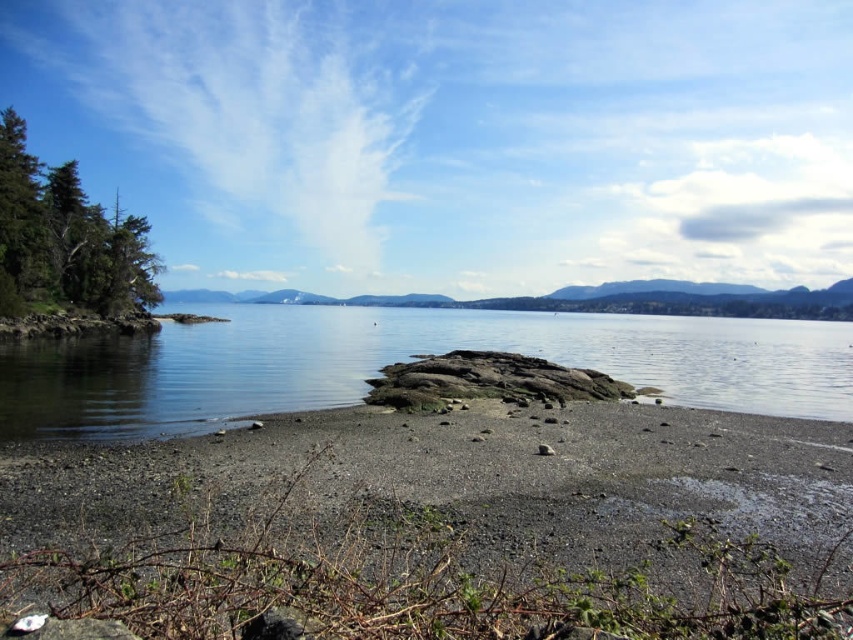
You are a hiker who wants to cross from the green textured tree at left to the clear water at center. Given that your maximum comfortable walking distance is 30 meters, can you safely make this journey without getting tired?

The distance between the green textured tree at left and the clear water at center is 26.39 meters, which is within your maximum comfortable walking distance of 30 meters. Therefore, you can safely make the journey without getting tired.

You are standing on the beach and want to collect the smooth pebbles at center. According to the coordinates provided, where should you look to find them?

The smooth pebbles at center are located at coordinates point (428,488), so you should look towards the center of the beach slightly towards the right to find them.

You are a hiker who wants to cross the beach to reach the water. You have a small backpack with you. The smooth pebbles at center and the green textured tree at left are in your path. Which object is wider, making it harder to navigate around with your backpack?

The smooth pebbles at center might be wider than green textured tree at left, so the smooth pebbles at center could be harder to navigate around with your backpack.